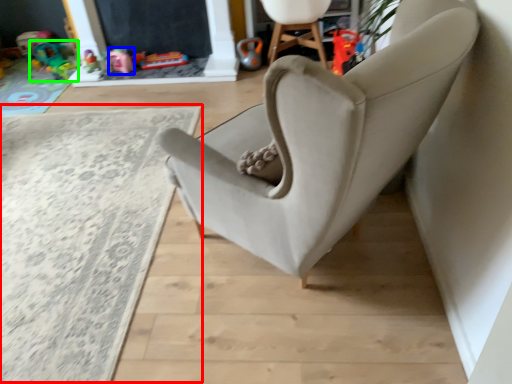
Question: Which object is positioned farthest from plain (highlighted by a red box)? Select from toy (highlighted by a blue box) and toy (highlighted by a green box).

Choices:
 (A) toy
 (B) toy

Answer: (B)